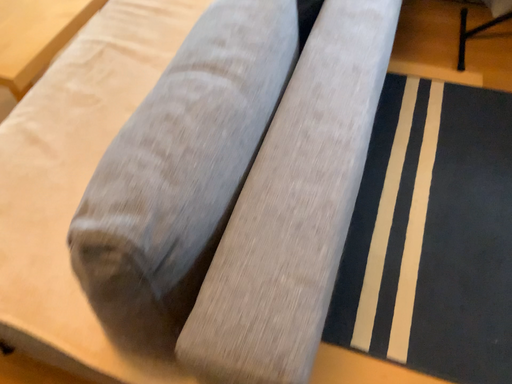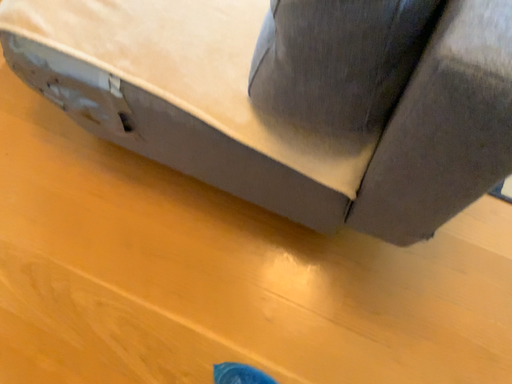
Question: How did the camera likely rotate when shooting the video?

Choices:
 (A) rotated downward
 (B) rotated upward

Answer: (A)